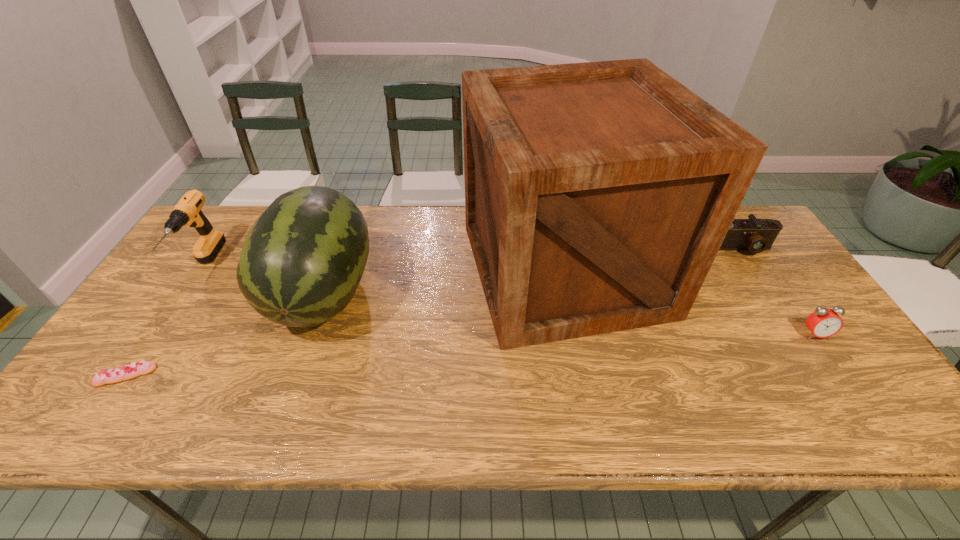
The width and height of the screenshot is (960, 540). Find the location of `eclair that is positioned at the left edge`. eclair that is positioned at the left edge is located at coordinates (135, 369).

Locate an element on the screen. This screenshot has height=540, width=960. camera that is at the right edge is located at coordinates [x=756, y=235].

The height and width of the screenshot is (540, 960). I want to click on alarm clock at the right edge, so click(823, 322).

Locate an element on the screen. Image resolution: width=960 pixels, height=540 pixels. object present at the far left corner is located at coordinates (188, 212).

Where is `object that is at the far right corner`? The height and width of the screenshot is (540, 960). object that is at the far right corner is located at coordinates (756, 235).

In the image, there is a desktop. At what (x,y) coordinates should I click in order to perform the action: click on free space at the far edge. Please return your answer as a coordinate pair (x, y). Looking at the image, I should click on [x=418, y=245].

The height and width of the screenshot is (540, 960). What are the coordinates of `vacant space at the near edge of the desktop` in the screenshot? It's located at (331, 407).

In the image, there is a desktop. Where is `blank space at the left edge`? Image resolution: width=960 pixels, height=540 pixels. blank space at the left edge is located at coordinates [x=162, y=287].

This screenshot has height=540, width=960. In the image, there is a desktop. What are the coordinates of `free space at the right edge` in the screenshot? It's located at (782, 350).

At what (x,y) coordinates should I click in order to perform the action: click on vacant region between the camera and the nearest object. Please return your answer as a coordinate pair (x, y). The width and height of the screenshot is (960, 540). Looking at the image, I should click on (433, 312).